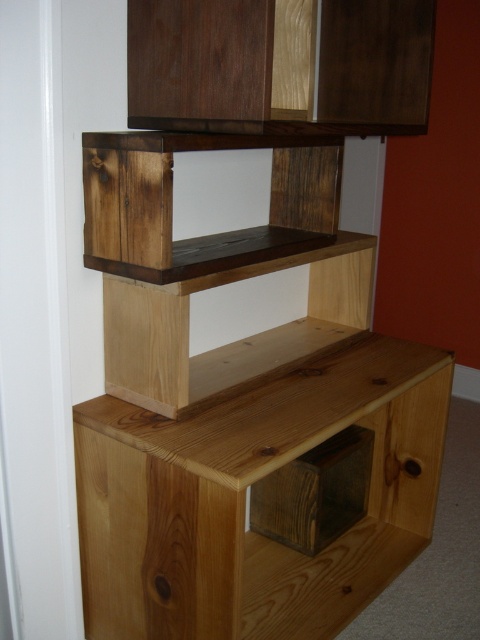
You are organizing items on the wooden shelving unit and need to place a large decorative item. Which object, the natural wood drawer at lower center or the dark brown wood cabinet at upper center, is closer to you so you can place the item there?

The natural wood drawer at lower center is closer to you because it is in front of the dark brown wood cabinet at upper center, which is behind it.

You are organizing books on the wooden shelving unit. You have a heavy book that needs to be placed on a sturdy surface. Which object should you choose between the natural wood drawer at lower center and the natural wood shelf at center?

The natural wood shelf at center is the better choice for placing the heavy book because it is positioned above the natural wood drawer at lower center, indicating it is designed to support weight more effectively.